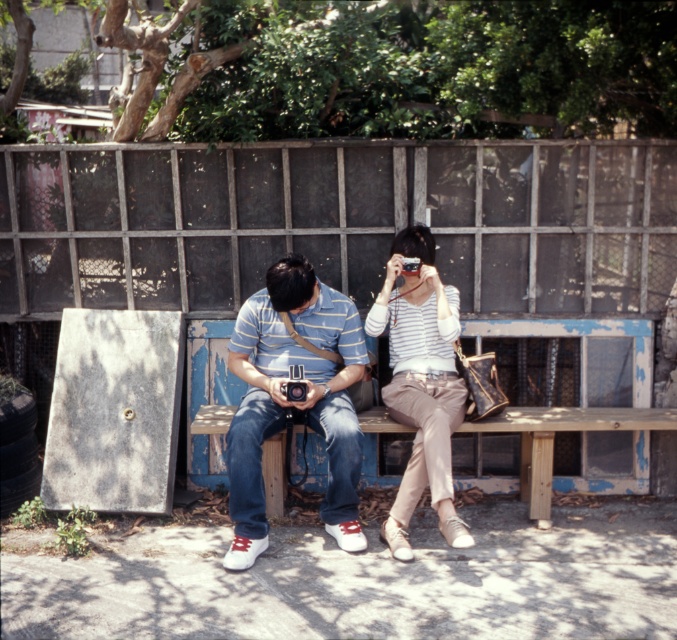
Question: Which point is closer to the camera?

Choices:
 (A) (234, 481)
 (B) (548, 468)

Answer: (A)

Question: Is matte blue striped shirt at center below wooden bench at center?

Choices:
 (A) yes
 (B) no

Answer: (B)

Question: Which of the following is the farthest from the observer?

Choices:
 (A) (343, 321)
 (B) (439, 448)

Answer: (A)

Question: Which object appears closest to the camera in this image?

Choices:
 (A) striped cotton shirt at center
 (B) wooden bench at center
 (C) matte blue striped shirt at center

Answer: (A)

Question: Does striped cotton shirt at center have a greater width compared to wooden bench at center?

Choices:
 (A) no
 (B) yes

Answer: (A)

Question: Does striped cotton shirt at center appear on the left side of wooden bench at center?

Choices:
 (A) no
 (B) yes

Answer: (B)